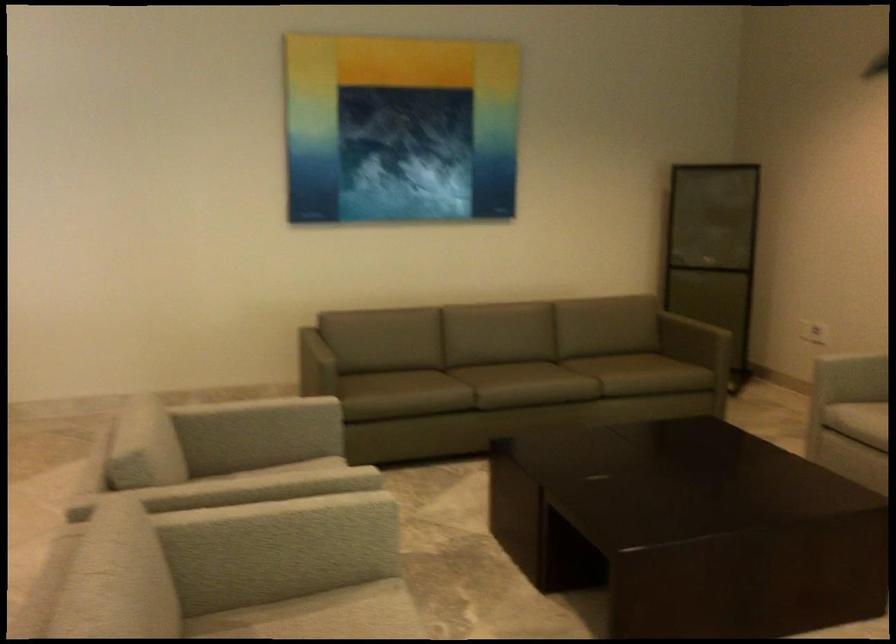
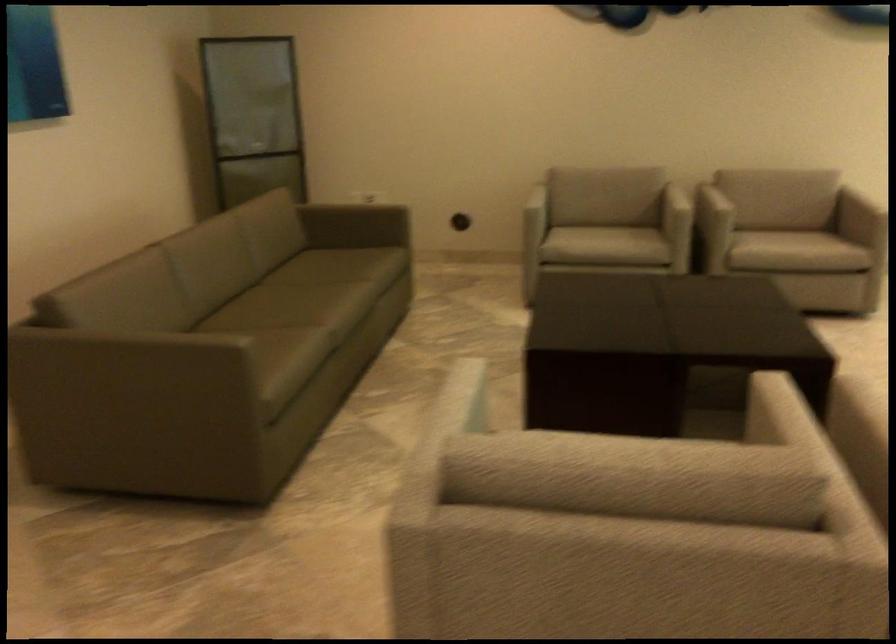
Locate, in the second image, the point that corresponds to (316,345) in the first image.

(133, 337)